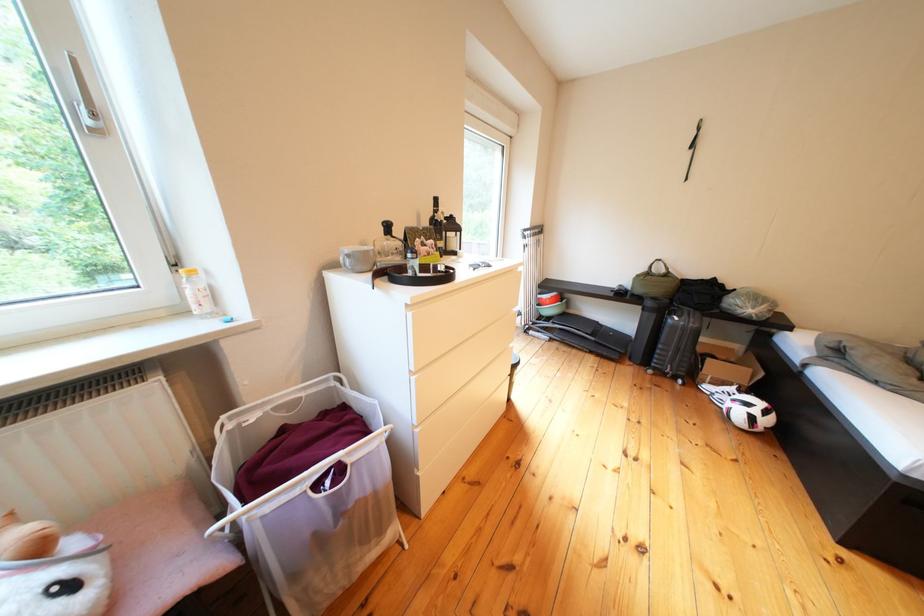
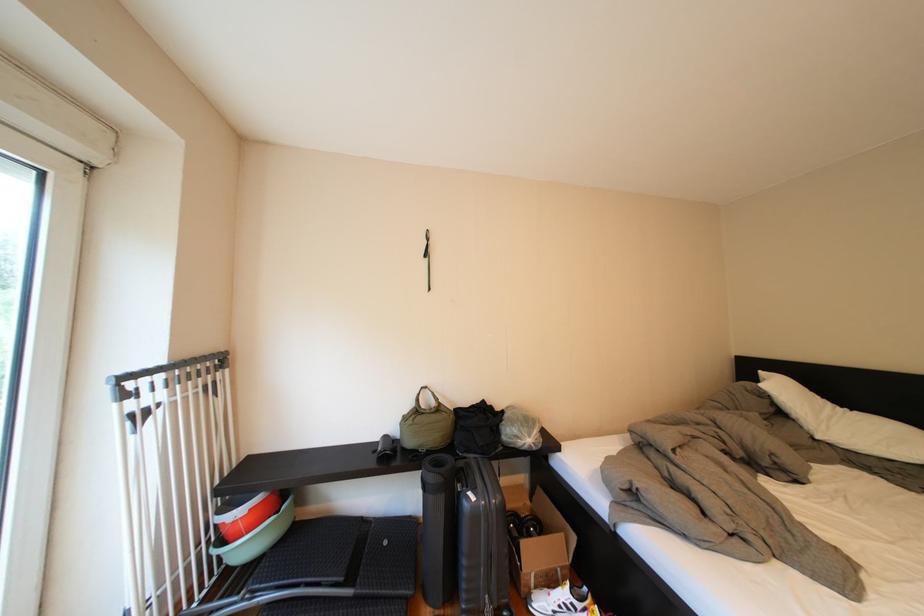
Where in the second image is the point corresponding to the point at 727,371 from the first image?

(544, 557)